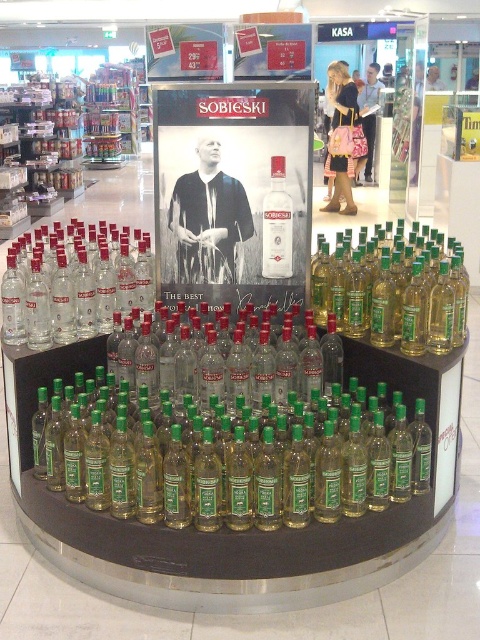
Question: Is transparent glass bottles at left positioned at the back of green glass bottle at right?

Choices:
 (A) yes
 (B) no

Answer: (A)

Question: Which of the following is the closest to the observer?

Choices:
 (A) clear glass bottle at center
 (B) transparent glass bottles at left
 (C) green glass bottle at right
 (D) matte black poster at center

Answer: (C)

Question: Can you confirm if matte black poster at center is smaller than clear glass bottle at center?

Choices:
 (A) yes
 (B) no

Answer: (B)

Question: Which of the following is the closest to the observer?

Choices:
 (A) (460, 289)
 (B) (147, 288)

Answer: (A)

Question: Which object is positioned farthest from the clear glass bottle at center?

Choices:
 (A) transparent glass bottles at left
 (B) green glass bottle at right
 (C) matte black poster at center

Answer: (A)

Question: Is matte black poster at center to the right of transparent glass bottles at left from the viewer's perspective?

Choices:
 (A) no
 (B) yes

Answer: (B)